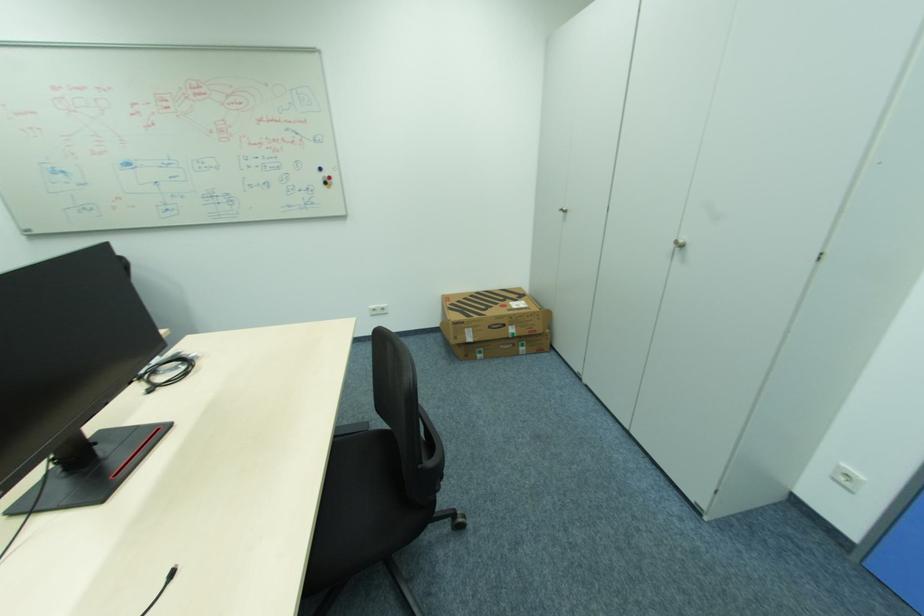
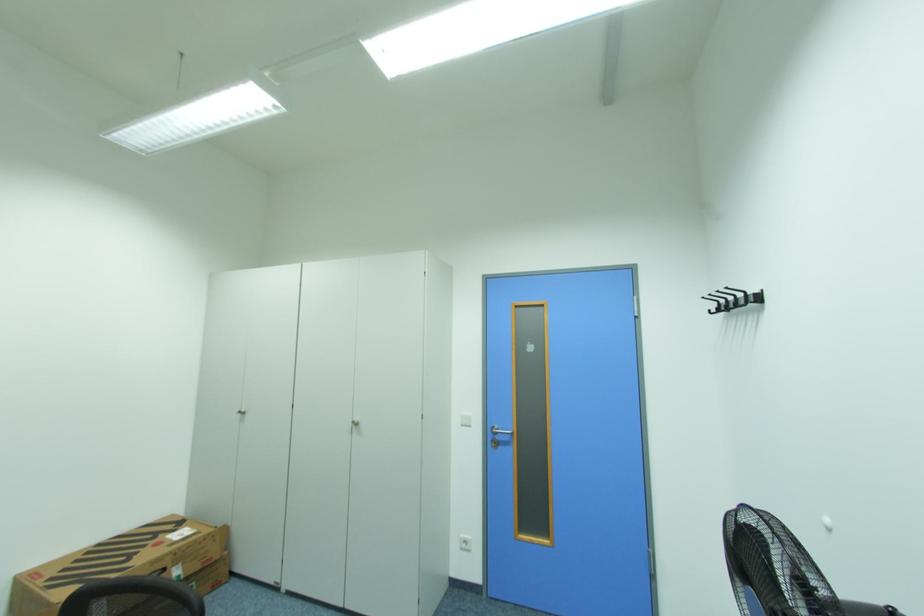
The first image is from the beginning of the video and the second image is from the end. How did the camera likely rotate when shooting the video?

The rotation direction of the camera is right-up.